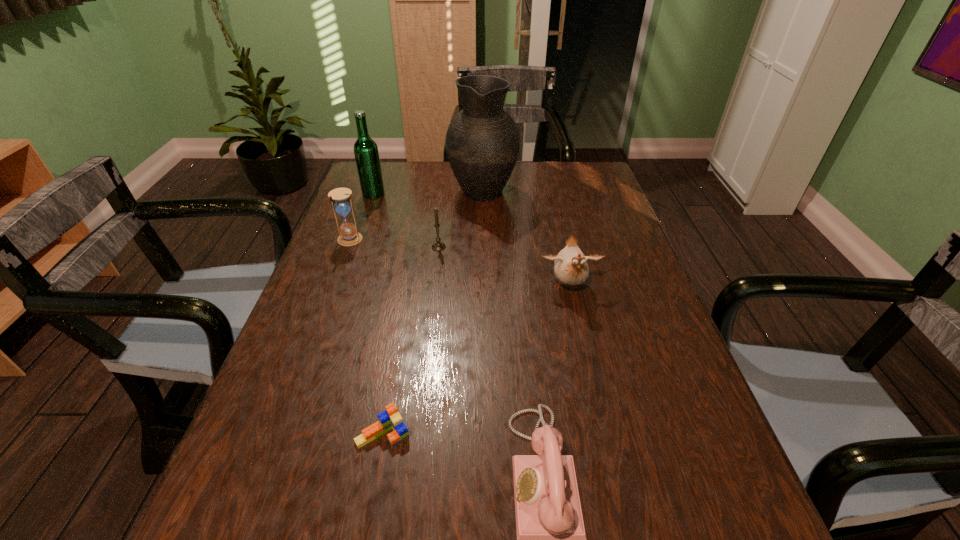
Where is `the tallest object`? The image size is (960, 540). the tallest object is located at coordinates coord(482,142).

Identify the location of beer bottle. (366, 153).

Locate an element on the screen. The image size is (960, 540). hourglass is located at coordinates (341, 201).

Locate an element on the screen. This screenshot has height=540, width=960. bird is located at coordinates (570, 265).

Find the location of a particular element. The image size is (960, 540). candle is located at coordinates (438, 246).

This screenshot has height=540, width=960. What are the coordinates of `the shortest object` in the screenshot? It's located at (390, 418).

At what (x,y) coordinates should I click in order to perform the action: click on free space located 0.080m on the side of the tallest object with the handle. Please return your answer as a coordinate pair (x, y). This screenshot has width=960, height=540. Looking at the image, I should click on (482, 161).

Find the location of `free space located 0.070m on the side of the tallest object with the handle`. free space located 0.070m on the side of the tallest object with the handle is located at coordinates (482, 163).

Locate an element on the screen. free space located on the side of the tallest object with the handle is located at coordinates (482, 161).

Locate an element on the screen. This screenshot has width=960, height=540. free space located on the right of the sixth shortest object is located at coordinates (463, 194).